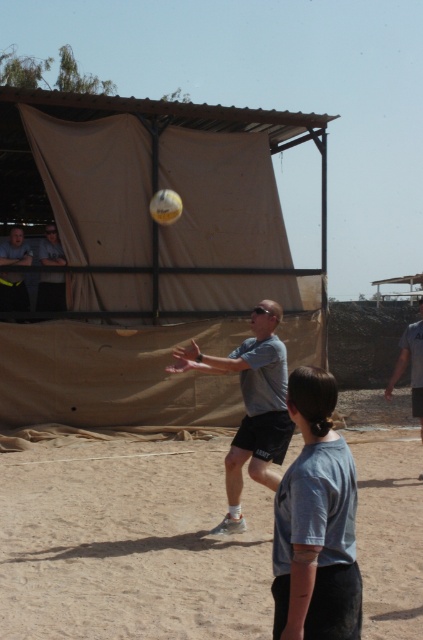
Question: Is light blue shirt at lower center positioned before matte gray shirt at left?

Choices:
 (A) no
 (B) yes

Answer: (B)

Question: Considering the real-world distances, which object is farthest from the gray fabric shirt at center?

Choices:
 (A) brown sandy dirt at center
 (B) light blue shirt at lower center
 (C) matte gray shirt at left
 (D) gray matte shirt at center

Answer: (B)

Question: Among these objects, which one is nearest to the camera?

Choices:
 (A) matte black laptop at left
 (B) gray matte shirt at center

Answer: (B)

Question: Where is matte black laptop at left located in relation to yellow matte volleyball at center in the image?

Choices:
 (A) right
 (B) left

Answer: (B)

Question: Which of these objects is positioned farthest from the matte gray shirt at left?

Choices:
 (A) gray fabric shirt at center
 (B) light blue shirt at lower center
 (C) brown sandy dirt at center
 (D) yellow matte volleyball at center

Answer: (B)

Question: Does light blue shirt at lower center come in front of gray fabric shirt at center?

Choices:
 (A) no
 (B) yes

Answer: (B)